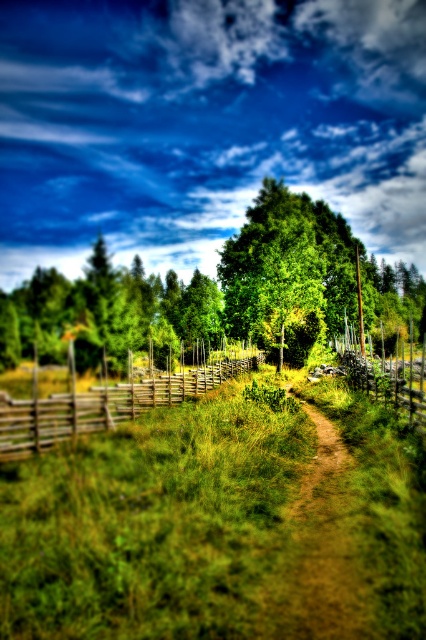
You are standing at the point with coordinates point (x=69, y=324) and want to walk to point (x=356, y=376). Given that the path is 1 meter wide, can you walk directly to the destination without crossing the fence?

Since point (x=69, y=324) is closer to the camera than point (x=356, y=376), you are currently standing closer to the starting point. The path is 1 meter wide, so as long as the distance between the two points is within the path width, you can walk directly without crossing the fence. However, without knowing the exact distance between the points, it is impossible to confirm if the path width is sufficient. Please provide more information about the distance between the two points.

Consider the image. You are a hiker standing at the start of the dirt path. You want to take a photo of the green leafy tree at center and the wooden fence at left. Which object should you focus on first to ensure both are in the frame?

The wooden fence at left is closer to you than the green leafy tree at center, so focus on the wooden fence at left first to ensure both are in the frame.